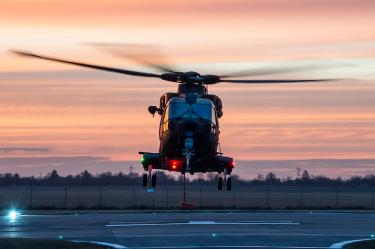
Image resolution: width=375 pixels, height=249 pixels. Find the location of `red lights`. red lights is located at coordinates (174, 165), (233, 162).